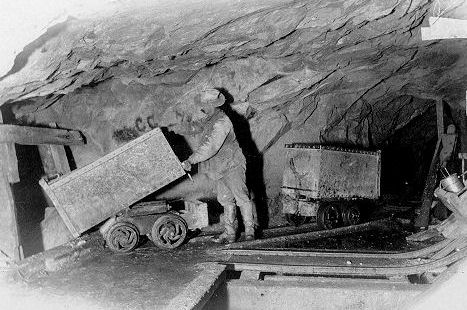
Locate an element on the screen. This screenshot has width=467, height=310. bin is located at coordinates (145, 183).